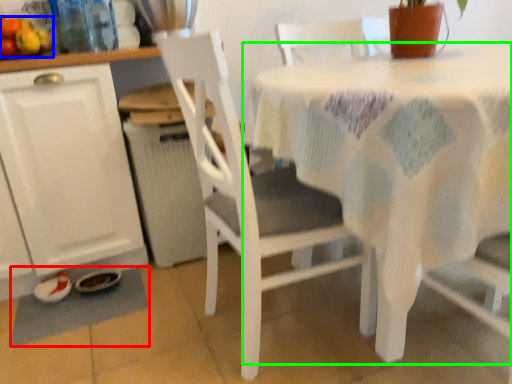
Question: Which object is positioned farthest from place mat (highlighted by a red box)? Select from fruit (highlighted by a blue box) and table (highlighted by a green box).

Choices:
 (A) fruit
 (B) table

Answer: (B)